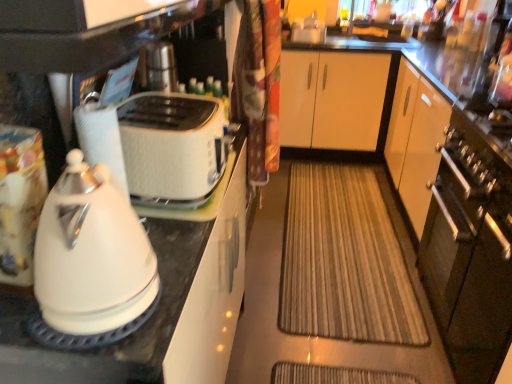
Question: In terms of width, does white glossy kettle at left look wider or thinner when compared to white glossy paper towel at left?

Choices:
 (A) thin
 (B) wide

Answer: (B)

Question: Based on their positions, is white glossy kettle at left located to the left or right of white glossy paper towel at left?

Choices:
 (A) right
 (B) left

Answer: (A)

Question: Which object is positioned farthest from the satin silver oven at right?

Choices:
 (A) white glossy kettle at left
 (B) white textured toaster at center
 (C) white glossy paper towel at left
 (D) brown textured mat at center
 (E) white glossy toaster at left

Answer: (C)

Question: Estimate the real-world distances between objects in this image. Which object is closer to the white glossy toaster at left?

Choices:
 (A) white textured toaster at center
 (B) satin silver oven at right
 (C) white glossy paper towel at left
 (D) brown textured mat at center
 (E) white glossy kettle at left

Answer: (A)